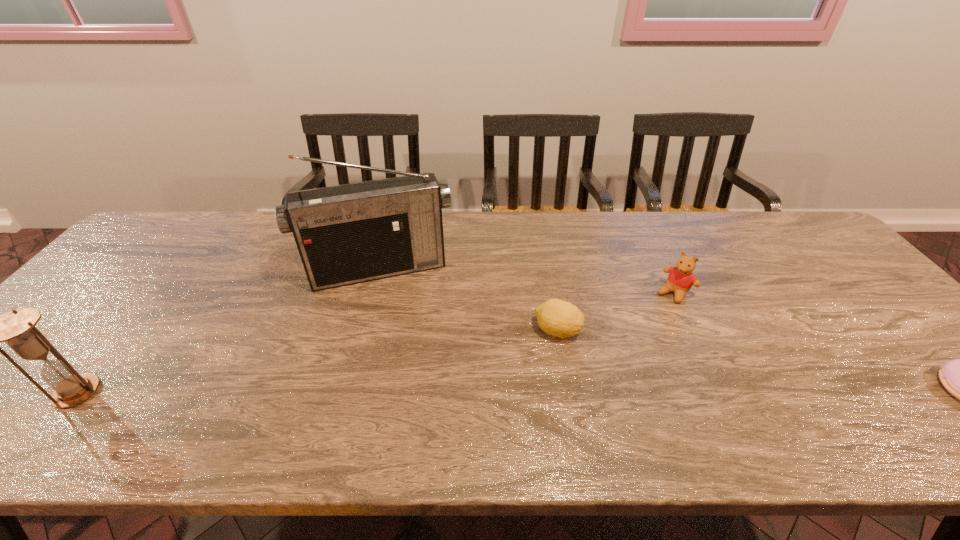
This screenshot has height=540, width=960. Find the location of `object that is the third closest to the lemon`. object that is the third closest to the lemon is located at coordinates (959, 376).

Identify which object is located as the third nearest to the rightmost object. Please provide its 2D coordinates. Your answer should be formatted as a tuple, i.e. [(x, y)], where the tuple contains the x and y coordinates of a point satisfying the conditions above.

[(346, 234)]

The height and width of the screenshot is (540, 960). I want to click on vacant region that satisfies the following two spatial constraints: 1. on the back side of the third object from left to right; 2. on the left side of the second object from right to left, so click(551, 293).

Where is `free space that satisfies the following two spatial constraints: 1. on the back side of the teddy bear; 2. on the right side of the third farthest object`? Image resolution: width=960 pixels, height=540 pixels. free space that satisfies the following two spatial constraints: 1. on the back side of the teddy bear; 2. on the right side of the third farthest object is located at coordinates (551, 293).